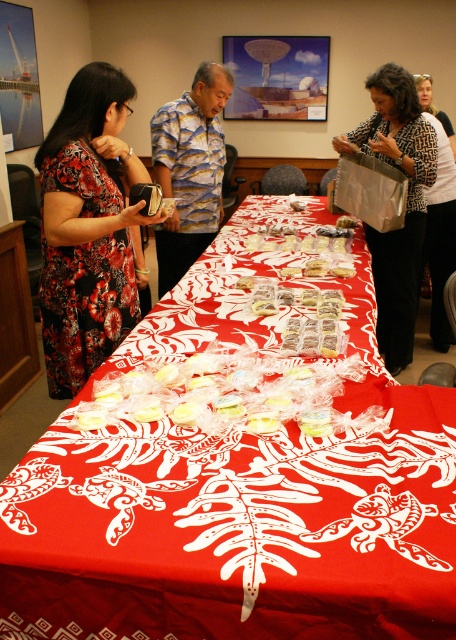
You are attending a formal event and see the red fabric table at center and the floral dress at left. Which object is positioned to the right side of the other?

The red fabric table at center is to the right of the floral dress at left.

You are standing in the room and want to place a new item on the table. Where exactly should you place it to ensure it sits precisely at the center of the red fabric table at center?

Place the item at the coordinates point (239,520) to ensure it sits precisely at the center of the red fabric table at center.

You are at the event and want to place your matte silver bag at center on the red fabric table at center. Can you directly put it there without moving any items on the table?

The red fabric table at center is closer to the viewer than the matte silver bag at center, so the bag is not currently on the table. However, the question of whether there is space to place it there cannot be determined from the given information.